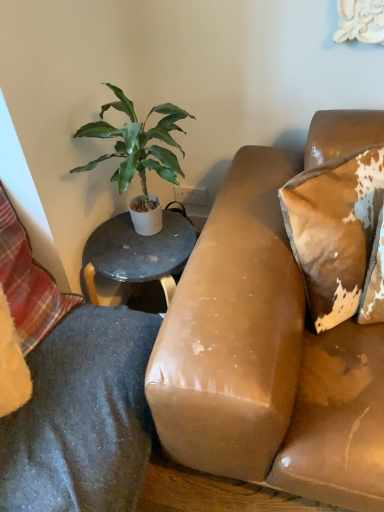
Question: Is plaid fabric pillow at lower left, the 1th pillow viewed from the left, not close to green leafy plant at upper left?

Choices:
 (A) yes
 (B) no

Answer: (B)

Question: Is plaid fabric pillow at lower left, the 1th pillow viewed from the left, turned away from green leafy plant at upper left?

Choices:
 (A) yes
 (B) no

Answer: (B)

Question: From the image's perspective, is plaid fabric pillow at lower left, the 1th pillow viewed from the left, above green leafy plant at upper left?

Choices:
 (A) no
 (B) yes

Answer: (A)

Question: Is plaid fabric pillow at lower left, the 1th pillow viewed from the left, smaller than green leafy plant at upper left?

Choices:
 (A) yes
 (B) no

Answer: (A)

Question: From a real-world perspective, is plaid fabric pillow at lower left, placed as the second pillow when sorted from right to left, positioned under green leafy plant at upper left based on gravity?

Choices:
 (A) no
 (B) yes

Answer: (B)

Question: Is plaid fabric pillow at lower left, placed as the second pillow when sorted from right to left, next to green leafy plant at upper left and touching it?

Choices:
 (A) no
 (B) yes

Answer: (A)

Question: Is green leafy plant at upper left aimed at plaid fabric pillow at lower left, the 1th pillow viewed from the left?

Choices:
 (A) no
 (B) yes

Answer: (A)

Question: Does green leafy plant at upper left have a lesser height compared to plaid fabric pillow at lower left, the 1th pillow viewed from the left?

Choices:
 (A) yes
 (B) no

Answer: (B)

Question: From a real-world perspective, is green leafy plant at upper left under plaid fabric pillow at lower left, the 1th pillow viewed from the left?

Choices:
 (A) no
 (B) yes

Answer: (A)

Question: Is green leafy plant at upper left at the left side of plaid fabric pillow at lower left, the 1th pillow viewed from the left?

Choices:
 (A) yes
 (B) no

Answer: (B)

Question: Is green leafy plant at upper left positioned in front of plaid fabric pillow at lower left, the 1th pillow viewed from the left?

Choices:
 (A) no
 (B) yes

Answer: (A)

Question: Is green leafy plant at upper left surrounding plaid fabric pillow at lower left, placed as the second pillow when sorted from right to left?

Choices:
 (A) no
 (B) yes

Answer: (A)

Question: From the image's perspective, would you say brown distressed leather pillow at upper right, positioned as the first pillow in right-to-left order, is shown under plaid fabric pillow at lower left, the 1th pillow viewed from the left?

Choices:
 (A) yes
 (B) no

Answer: (B)